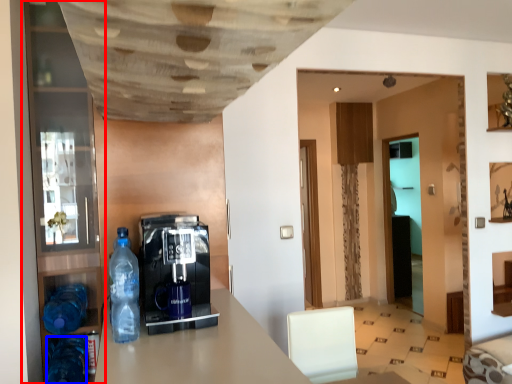
Question: Which point is closer to the camera, pantry (highlighted by a red box) or bottle (highlighted by a blue box)?

Choices:
 (A) pantry
 (B) bottle

Answer: (B)